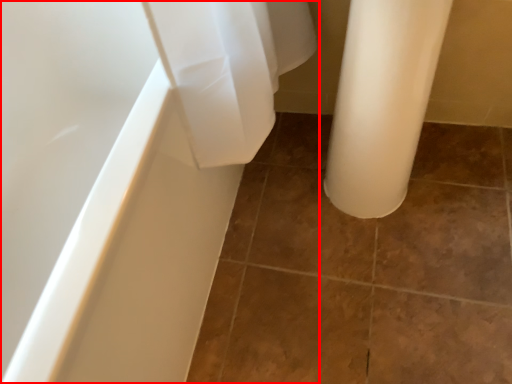
Question: From the image, what is the correct spatial relationship of bathtub (annotated by the red box) in relation to ceramic tile?

Choices:
 (A) right
 (B) left

Answer: (B)